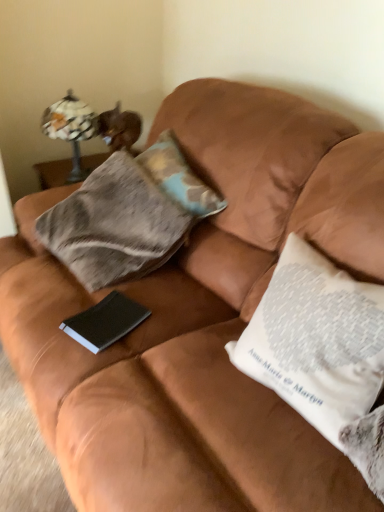
Question: Should I look upward or downward to see matte glass lamp at upper left?

Choices:
 (A) up
 (B) down

Answer: (A)

Question: Is camouflage fabric pillow at center, arranged as the second pillow when viewed from the front, shorter than black matte paper at center?

Choices:
 (A) no
 (B) yes

Answer: (A)

Question: Does camouflage fabric pillow at center, which appears as the first pillow when viewed from the back, have a smaller size compared to black matte paper at center?

Choices:
 (A) no
 (B) yes

Answer: (A)

Question: From a real-world perspective, is camouflage fabric pillow at center, which appears as the first pillow when viewed from the back, beneath black matte paper at center?

Choices:
 (A) yes
 (B) no

Answer: (B)

Question: Are camouflage fabric pillow at center, positioned as the first pillow in top-to-bottom order, and black matte paper at center located far from each other?

Choices:
 (A) yes
 (B) no

Answer: (B)

Question: Is camouflage fabric pillow at center, which appears as the first pillow when viewed from the back, not within black matte paper at center?

Choices:
 (A) no
 (B) yes

Answer: (B)

Question: Considering the relative positions of camouflage fabric pillow at center, positioned as the first pillow in top-to-bottom order, and black matte paper at center in the image provided, is camouflage fabric pillow at center, positioned as the first pillow in top-to-bottom order, to the left of black matte paper at center from the viewer's perspective?

Choices:
 (A) no
 (B) yes

Answer: (A)

Question: Is white printed pillow at right, placed as the 2th pillow when sorted from top to bottom, completely or partially inside camouflage fabric pillow at center, which appears as the first pillow when viewed from the back?

Choices:
 (A) no
 (B) yes

Answer: (A)

Question: Can you confirm if camouflage fabric pillow at center, arranged as the second pillow when viewed from the front, is positioned to the left of white printed pillow at right, the first pillow in the front-to-back sequence?

Choices:
 (A) no
 (B) yes

Answer: (B)

Question: Is camouflage fabric pillow at center, arranged as the second pillow when viewed from the front, not near white printed pillow at right, placed as the 2th pillow when sorted from top to bottom?

Choices:
 (A) yes
 (B) no

Answer: (B)

Question: Is camouflage fabric pillow at center, positioned as the 2th pillow in bottom-to-top order, oriented towards white printed pillow at right, the first pillow in the front-to-back sequence?

Choices:
 (A) yes
 (B) no

Answer: (B)

Question: From a real-world perspective, is camouflage fabric pillow at center, which appears as the first pillow when viewed from the back, located beneath white printed pillow at right, placed as the 2th pillow when sorted from top to bottom?

Choices:
 (A) yes
 (B) no

Answer: (B)

Question: Is camouflage fabric pillow at center, positioned as the first pillow in top-to-bottom order, looking in the opposite direction of white printed pillow at right, the first pillow in the front-to-back sequence?

Choices:
 (A) no
 (B) yes

Answer: (A)

Question: Is matte glass lamp at upper left positioned behind white printed pillow at right, the first pillow in the front-to-back sequence?

Choices:
 (A) no
 (B) yes

Answer: (B)